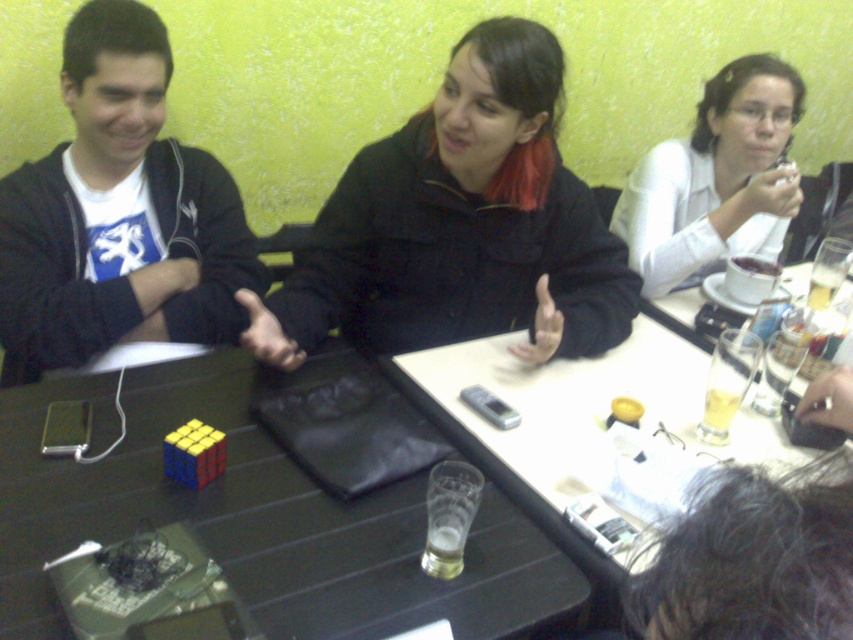
You are a server at the restaurant and need to clear the table. You see the translucent glass at table right and the translucent glass beer at table right. Which item should you pick up first to clear the table properly?

You should pick up the translucent glass beer at table right first because the translucent glass at table right is below it, so the beer glass is on top and needs to be removed first to access the glass underneath.

From the picture: You are sitting at a dark wooden table in a cozy cafe and want to place a small object exactly halfway between point (653, 243) and point (816, 300). Will the object be closer to the viewer or further away compared to the original points?

The halfway point between point (653, 243) and point (816, 300) would be closer to the viewer than point (816, 300) but further away than point (653, 243). Since the original points have different depths, the midpoint will be somewhere in between their depths.

You are a barista preparing drinks for the guests. You have two glasses at table right, one is translucent glass at table right and the other is translucent glass beer at table right. Which glass should you use if you need to serve a beverage that requires a wider container?

The translucent glass beer at table right should be used because it has a greater width than the translucent glass at table right, making it suitable for beverages requiring a wider container.